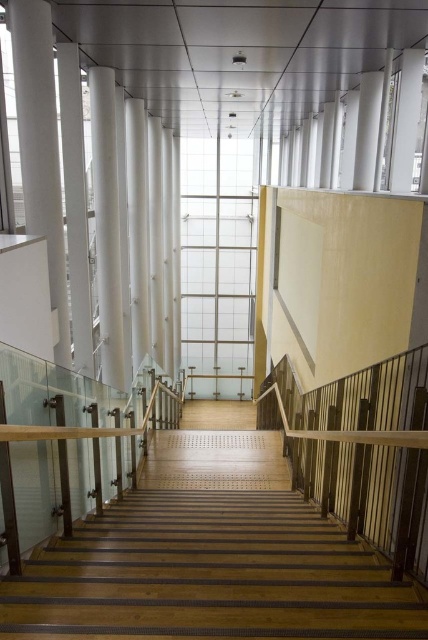
Between wooden stairs at center and white glossy pillar at center, which one is positioned higher?

white glossy pillar at center is higher up.

Between point (256, 632) and point (112, 230), which one is positioned behind?

Point (112, 230)

Where is `wooden stairs at center`? Image resolution: width=428 pixels, height=640 pixels. wooden stairs at center is located at coordinates (210, 573).

Which of these two, wooden at right or white glossy pillar at left, stands shorter?

Standing shorter between the two is wooden at right.

Measure the distance between wooden at right and camera.

3.27 meters

The height and width of the screenshot is (640, 428). Identify the location of wooden at right. (360, 451).

Can you confirm if wooden at right is positioned above white glossy pillar at center?

Incorrect, wooden at right is not positioned above white glossy pillar at center.

Who is more forward, [422,508] or [112,365]?

Point [422,508]

Where is `wooden at right`? The height and width of the screenshot is (640, 428). wooden at right is located at coordinates (360, 451).